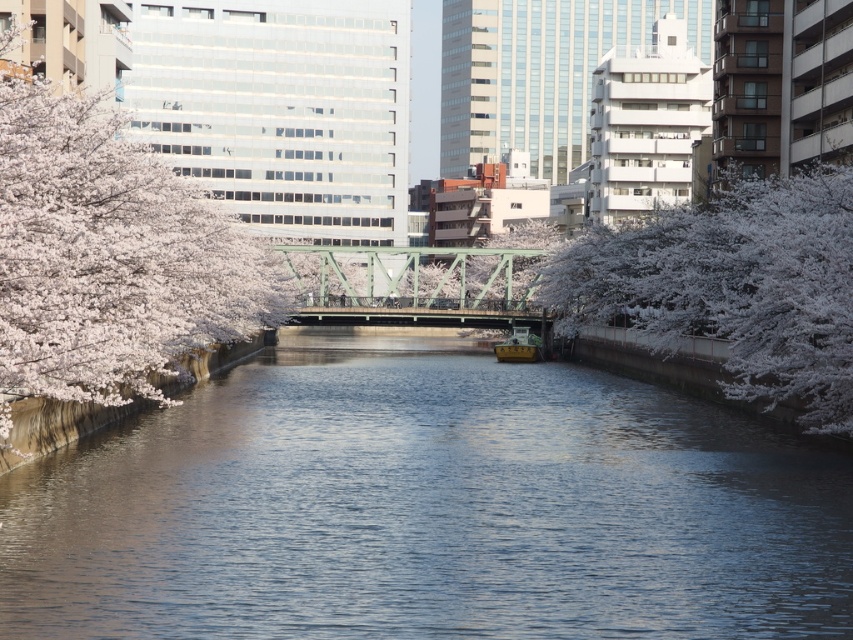
Is white blossoms at left smaller than gold polished wood boat at center?

Incorrect, white blossoms at left is not smaller in size than gold polished wood boat at center.

Between white blossoms at left and gold polished wood boat at center, which one has less height?

Standing shorter between the two is gold polished wood boat at center.

This screenshot has width=853, height=640. I want to click on white blossoms at left, so (x=109, y=257).

Based on the photo, does clear water at center lie in front of gold polished wood boat at center?

Yes.

Looking at this image, is clear water at center thinner than gold polished wood boat at center?

No.

This screenshot has width=853, height=640. I want to click on clear water at center, so click(428, 508).

Is white blossoms at right closer to the viewer compared to gold polished wood boat at center?

Yes, white blossoms at right is closer to the viewer.

Does point (697, 227) come closer to viewer compared to point (537, 358)?

Yes, point (697, 227) is closer to viewer.

Does point (813, 362) lie in front of point (496, 358)?

Yes, it is.

I want to click on white blossoms at right, so click(734, 285).